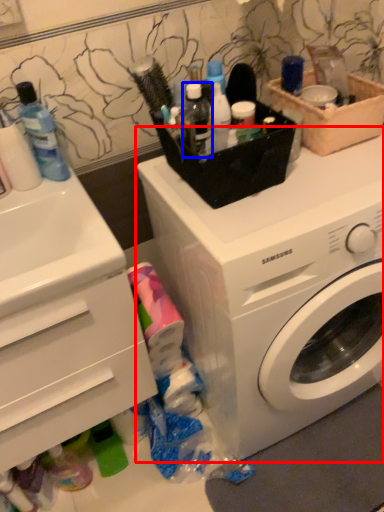
Question: Which point is further to the camera, washing machine (highlighted by a red box) or toiletry (highlighted by a blue box)?

Choices:
 (A) washing machine
 (B) toiletry

Answer: (B)